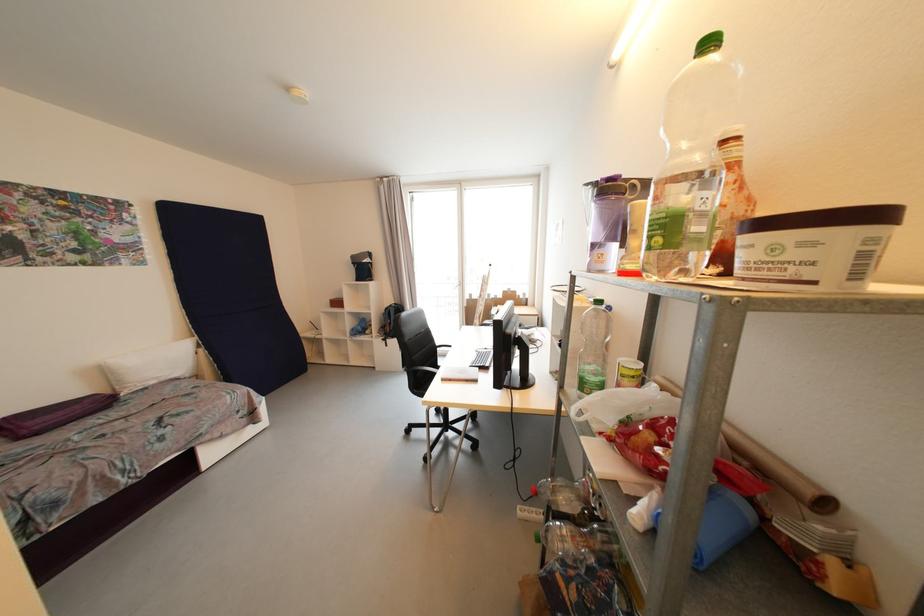
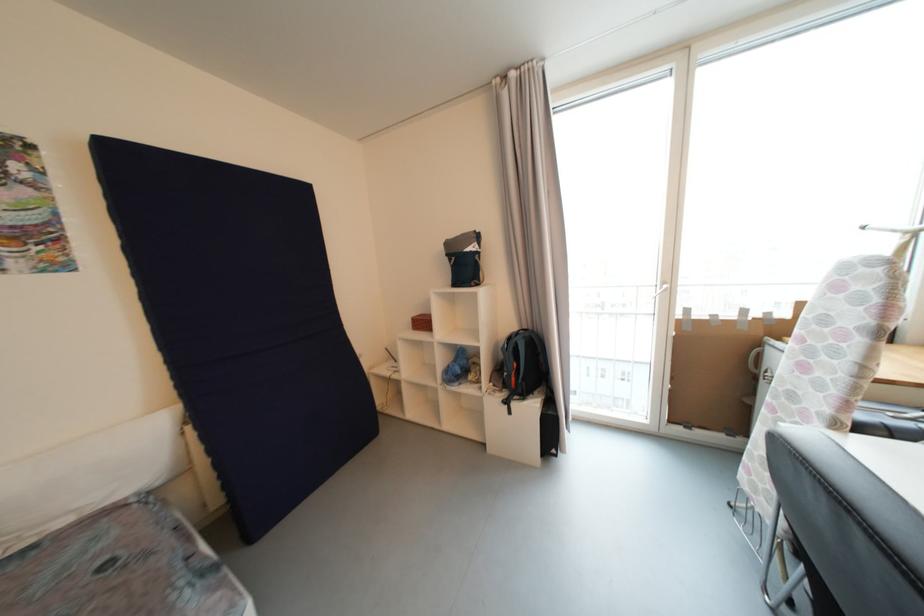
Which direction would the cameraman need to move to produce the second image?

The cameraman walked toward left, forward.